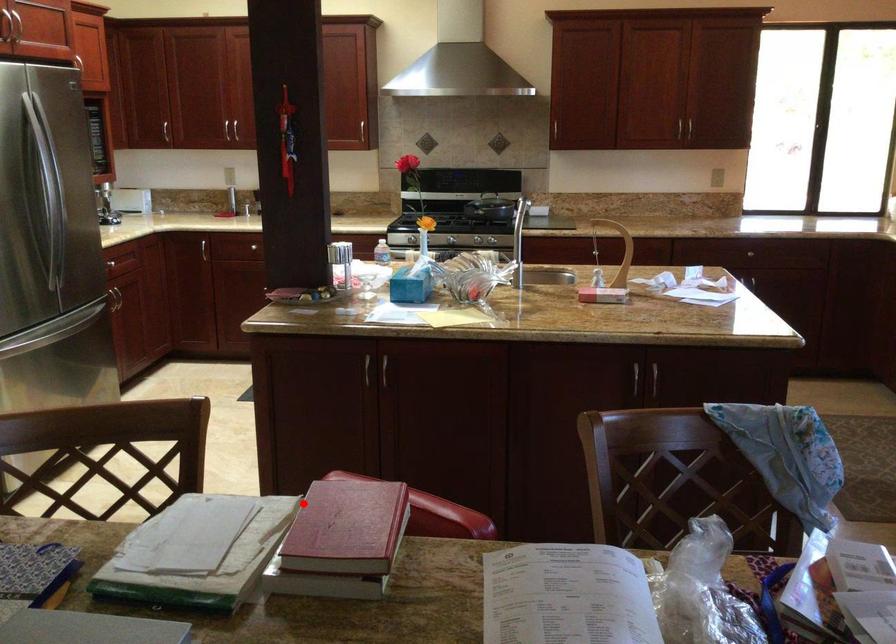
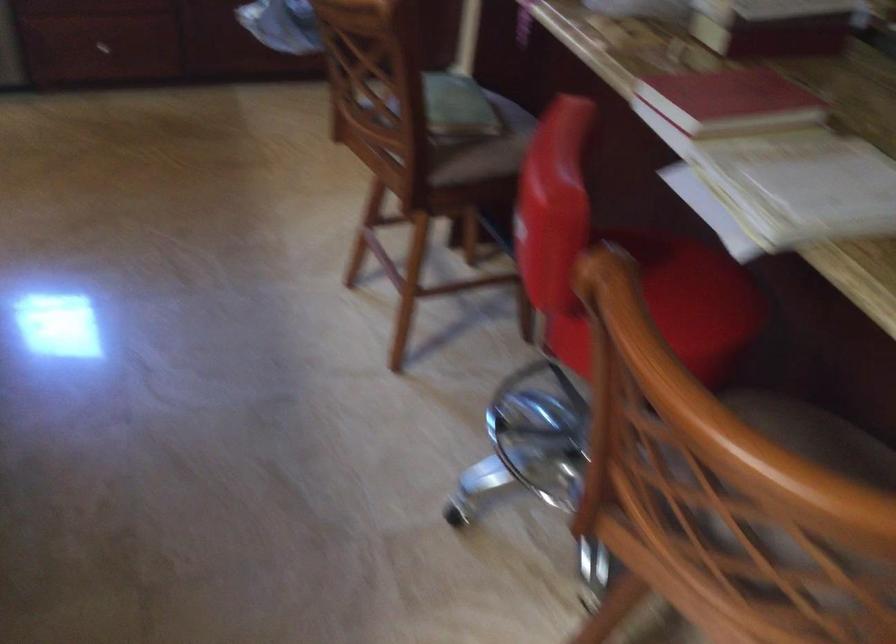
Find the pixel in the second image that matches the highlighted location in the first image.

(729, 100)